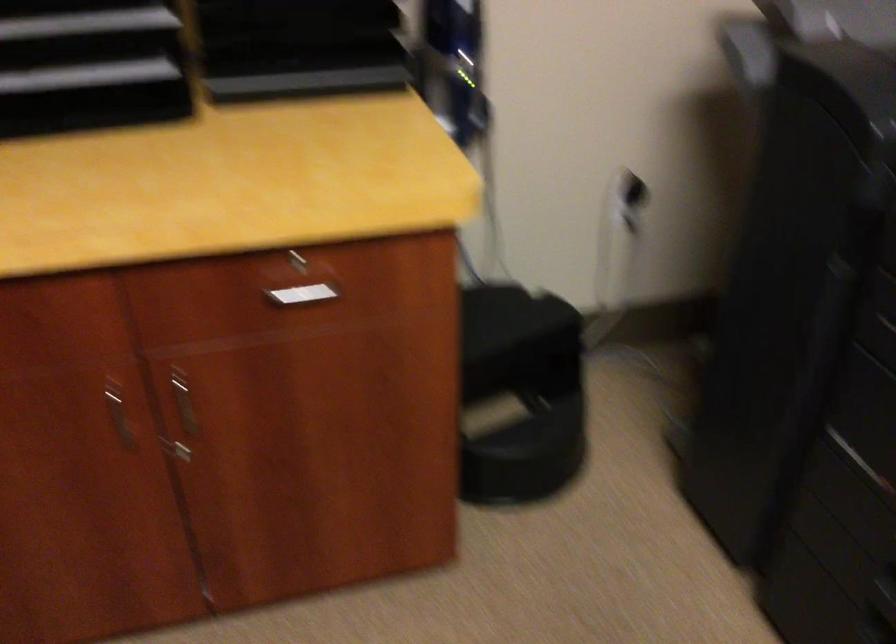
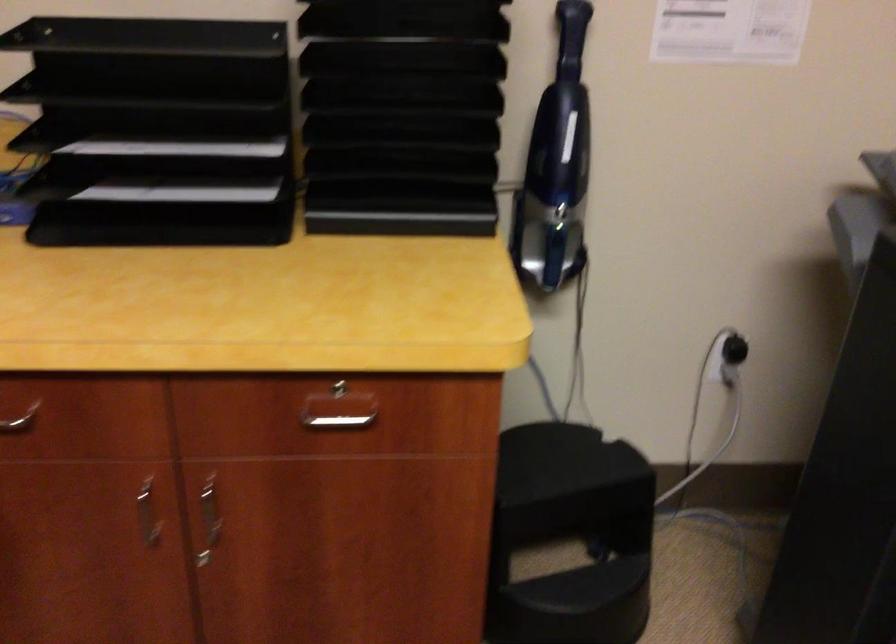
The point at (305, 263) is marked in the first image. Where is the corresponding point in the second image?

(342, 391)